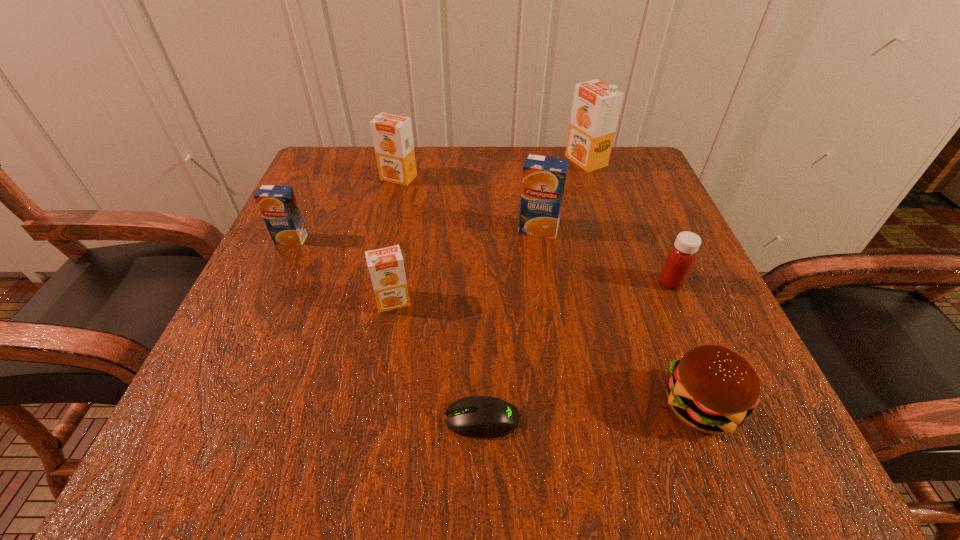
Where is `free space between the second biggest orange orange juice and the leftmost object`? The image size is (960, 540). free space between the second biggest orange orange juice and the leftmost object is located at coordinates pyautogui.click(x=345, y=208).

You are a GUI agent. You are given a task and a screenshot of the screen. Output one action in this format:
    pyautogui.click(x=<x>, y=<y>)
    Task: Click on the free area in between the shortest object and the red medicine
    
    Given the screenshot: What is the action you would take?
    pyautogui.click(x=576, y=351)

Identify the location of empty location between the nearest orange orange juice and the computer mouse. (438, 361).

Identify the location of empty space between the nearest orange juice and the bigger blue orange_juice. [466, 265].

I want to click on vacant region between the nearest orange orange juice and the hamburger, so click(x=546, y=353).

Where is `free point between the red medicine and the shortest object`? This screenshot has width=960, height=540. free point between the red medicine and the shortest object is located at coordinates (576, 351).

Find the location of a particular element. vacant region between the red medicine and the smallest orange orange juice is located at coordinates (532, 292).

At what (x,y) coordinates should I click in order to perform the action: click on object that stands as the fourth closest to the leftmost orange juice. Please return your answer as a coordinate pair (x, y). The width and height of the screenshot is (960, 540). Looking at the image, I should click on (476, 416).

Select which object is the third closest to the brown hamburger. Please provide its 2D coordinates. Your answer should be formatted as a tuple, i.e. [(x, y)], where the tuple contains the x and y coordinates of a point satisfying the conditions above.

[(543, 182)]

This screenshot has width=960, height=540. I want to click on orange juice that stands as the second closest to the hamburger, so click(386, 266).